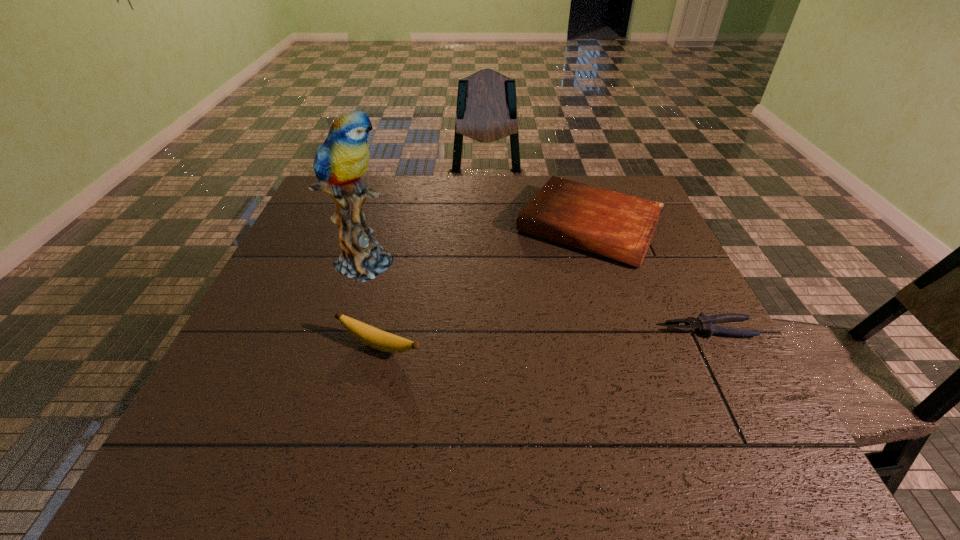
Identify the location of free space that satisfies the following two spatial constraints: 1. on the front side of the banana; 2. on the right side of the parrot. (341, 346).

The width and height of the screenshot is (960, 540). I want to click on vacant space that satisfies the following two spatial constraints: 1. on the front side of the Bible; 2. at the gripping part of the shortest object, so click(622, 329).